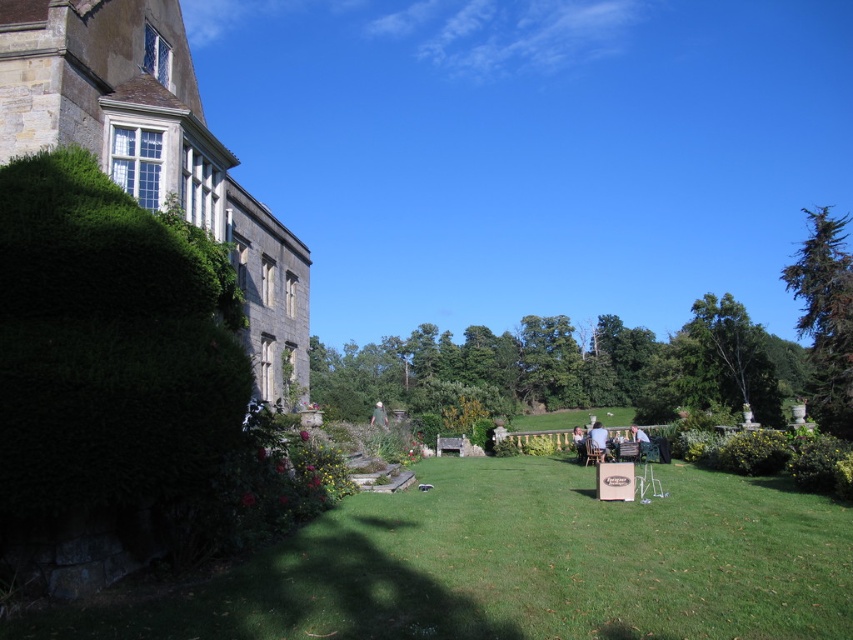
You are a guest at this event and want to move from your current position to the green fabric chair at lower right without walking behind the light blue fabric chair at center. Is this possible?

The light blue fabric chair at center is further to the viewer than the green fabric chair at lower right, so you can walk around the light blue fabric chair at center to reach the green fabric chair at lower right without going behind it.

You are planning to place a small side table between the light blue fabric chair at center and the green fabric chair at lower right. The table requires 7 feet of space to fit comfortably. Based on the scene, will there be enough space for the table between them?

The light blue fabric chair at center and green fabric chair at lower right are 6.74 feet apart. Since the required space for the table is 7 feet, there isn not enough space between them to place the table comfortably.

You are organizing a small event and need to place a decorative banner between the light blue fabric chair at center and the green fabric chair at lower right. Based on their positions, where should you place the banner?

Since the light blue fabric chair at center is located above the green fabric chair at lower right, you should place the banner between them along the vertical axis, positioning it below the light blue fabric chair at center and above the green fabric chair at lower right to ensure it is between both chairs.